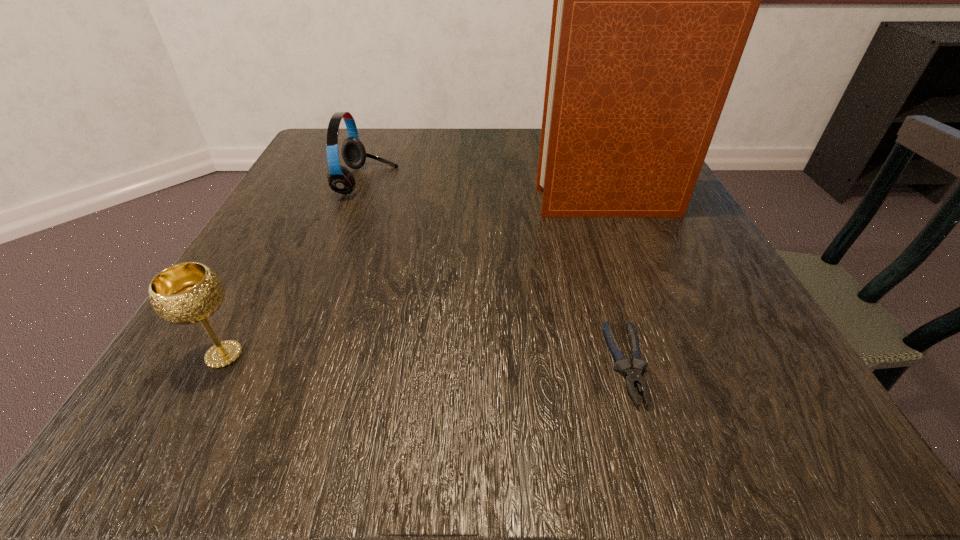
Image resolution: width=960 pixels, height=540 pixels. I want to click on vacant space at the right edge, so click(702, 279).

This screenshot has height=540, width=960. In the image, there is a desktop. Find the location of `vacant space at the far left corner`. vacant space at the far left corner is located at coordinates tap(361, 140).

The width and height of the screenshot is (960, 540). In the image, there is a desktop. What are the coordinates of `free region at the near left corner` in the screenshot? It's located at (248, 404).

Where is `free space at the near right corner`? free space at the near right corner is located at coordinates (739, 418).

Where is `vacant space that is in between the second object from left to right and the pliers`? The height and width of the screenshot is (540, 960). vacant space that is in between the second object from left to right and the pliers is located at coordinates (497, 273).

I want to click on free area in between the shortest object and the headset, so click(497, 273).

Identify the location of free space between the second object from left to right and the pliers. This screenshot has width=960, height=540. (497, 273).

Find the location of `empty space that is in between the tallest object and the pliers`. empty space that is in between the tallest object and the pliers is located at coordinates click(x=619, y=284).

Identify the location of unoccupied position between the second object from left to right and the pliers. The height and width of the screenshot is (540, 960). (497, 273).

The width and height of the screenshot is (960, 540). Identify the location of vacant space that is in between the pliers and the leftmost object. (426, 360).